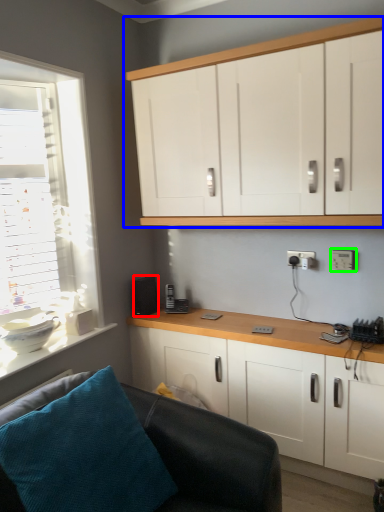
Question: Which object is positioned closest to speaker (highlighted by a red box)? Select from cabinetry (highlighted by a blue box) and electric outlet (highlighted by a green box).

Choices:
 (A) cabinetry
 (B) electric outlet

Answer: (B)